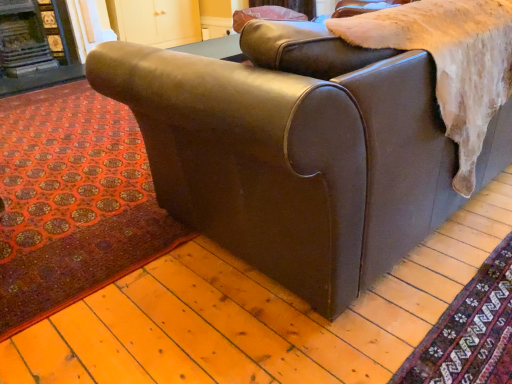
Question: Does matte brown leather couch at center have a lesser width compared to red carpet at lower left, which is counted as the second mat, starting from the front?

Choices:
 (A) no
 (B) yes

Answer: (B)

Question: From the image's perspective, is matte brown leather couch at center over red carpet at lower left, which ranks as the 1th mat in back-to-front order?

Choices:
 (A) no
 (B) yes

Answer: (B)

Question: From a real-world perspective, is matte brown leather couch at center over red carpet at lower left, which is counted as the second mat, starting from the front?

Choices:
 (A) yes
 (B) no

Answer: (A)

Question: Does matte brown leather couch at center have a lesser height compared to red carpet at lower left, the second mat from the right?

Choices:
 (A) no
 (B) yes

Answer: (A)

Question: Is matte brown leather couch at center far away from red carpet at lower left, the second mat from the right?

Choices:
 (A) yes
 (B) no

Answer: (B)

Question: Considering the positions of carpeted floor at lower right, which ranks as the first mat in right-to-left order, and matte brown leather couch at center in the image, is carpeted floor at lower right, which ranks as the first mat in right-to-left order, taller or shorter than matte brown leather couch at center?

Choices:
 (A) short
 (B) tall

Answer: (A)

Question: In the image, is carpeted floor at lower right, arranged as the first mat when viewed from the front, positioned in front of or behind matte brown leather couch at center?

Choices:
 (A) front
 (B) behind

Answer: (B)

Question: From a real-world perspective, is carpeted floor at lower right, which is counted as the 2th mat, starting from the left, above or below matte brown leather couch at center?

Choices:
 (A) above
 (B) below

Answer: (B)

Question: Is carpeted floor at lower right, which ranks as the first mat in right-to-left order, bigger or smaller than matte brown leather couch at center?

Choices:
 (A) small
 (B) big

Answer: (A)

Question: Is dark brown wood fireplace at upper left spatially inside carpeted floor at lower right, which ranks as the first mat in right-to-left order, or outside of it?

Choices:
 (A) outside
 (B) inside

Answer: (A)

Question: Considering the positions of dark brown wood fireplace at upper left and carpeted floor at lower right, which ranks as the first mat in right-to-left order, in the image, is dark brown wood fireplace at upper left taller or shorter than carpeted floor at lower right, which ranks as the first mat in right-to-left order,?

Choices:
 (A) tall
 (B) short

Answer: (A)

Question: Considering the positions of point (3, 82) and point (445, 377), is point (3, 82) closer or farther from the camera than point (445, 377)?

Choices:
 (A) closer
 (B) farther

Answer: (B)

Question: Visually, is dark brown wood fireplace at upper left positioned to the left or to the right of carpeted floor at lower right, arranged as the first mat when viewed from the front?

Choices:
 (A) left
 (B) right

Answer: (A)

Question: In terms of size, does carpeted floor at lower right, arranged as the first mat when viewed from the front, appear bigger or smaller than matte pink pillow at upper center?

Choices:
 (A) big
 (B) small

Answer: (B)

Question: Looking at their shapes, would you say carpeted floor at lower right, which is counted as the 2th mat, starting from the left, is wider or thinner than matte pink pillow at upper center?

Choices:
 (A) wide
 (B) thin

Answer: (A)